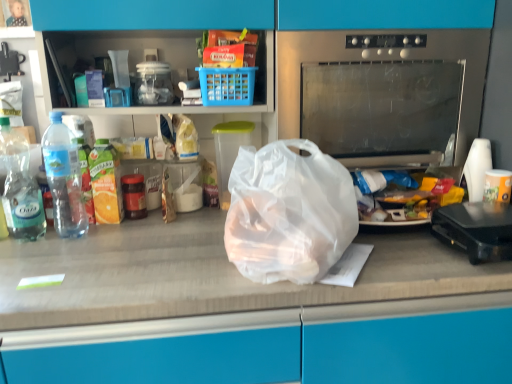
In order to click on free space on the front side of clear plastic bottle at left, positioned as the first bottle in right-to-left order in this screenshot , I will do `click(56, 256)`.